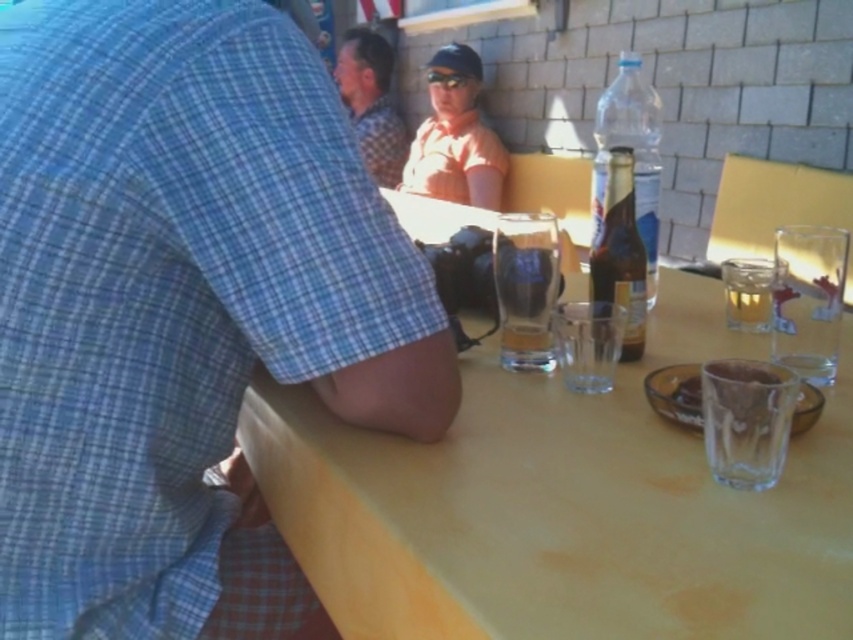
Question: Which point is farther to the camera?

Choices:
 (A) pyautogui.click(x=809, y=392)
 (B) pyautogui.click(x=502, y=333)
 (C) pyautogui.click(x=799, y=586)
 (D) pyautogui.click(x=639, y=220)

Answer: (D)

Question: Which object is closer to the camera taking this photo?

Choices:
 (A) brown glass bottle at center
 (B) clear plastic bottle at upper right
 (C) yellow matte table at center

Answer: (C)

Question: Considering the relative positions of transparent glass at lower right and checkered fabric shirt at upper center in the image provided, where is transparent glass at lower right located with respect to checkered fabric shirt at upper center?

Choices:
 (A) below
 (B) above

Answer: (A)

Question: Is yellow matte table at center behind brown glass bottle at center?

Choices:
 (A) no
 (B) yes

Answer: (A)

Question: Which point appears farthest from the camera in this image?

Choices:
 (A) (648, 129)
 (B) (693, 390)
 (C) (706, 404)

Answer: (A)

Question: Is blue plaid shirt at upper left wider than clear glass beer at center?

Choices:
 (A) yes
 (B) no

Answer: (A)